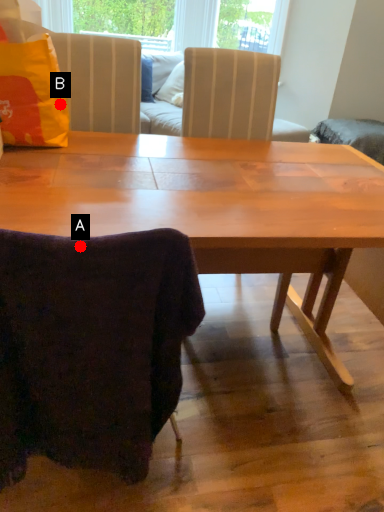
Question: Two points are circled on the image, labeled by A and B beside each circle. Which point is closer to the camera?

Choices:
 (A) A is closer
 (B) B is closer

Answer: (A)